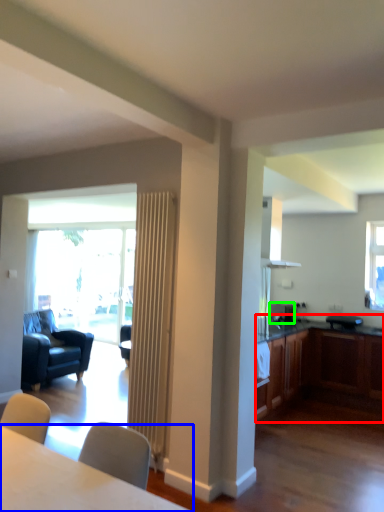
Question: Which object is the closest to the cabinetry (highlighted by a red box)? Choose among these: table (highlighted by a blue box) or appliance (highlighted by a green box).

Choices:
 (A) table
 (B) appliance

Answer: (B)